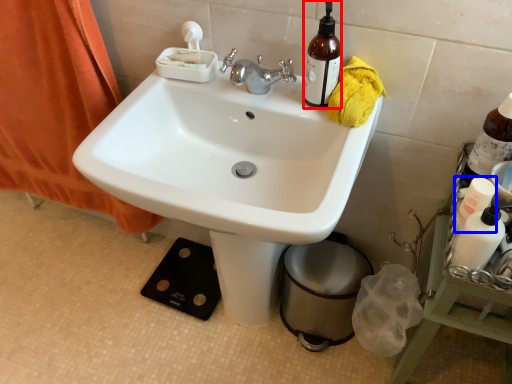
Question: Among these objects, which one is nearest to the camera, bottle (highlighted by a red box) or bottle (highlighted by a blue box)?

Choices:
 (A) bottle
 (B) bottle

Answer: (B)